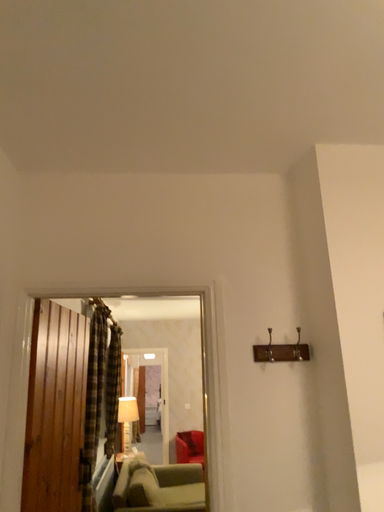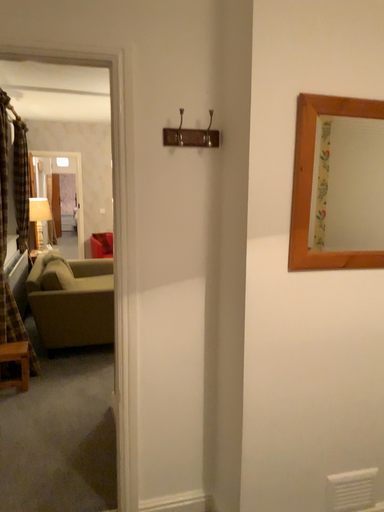
Question: How did the camera likely rotate when shooting the video?

Choices:
 (A) rotated left
 (B) rotated right

Answer: (B)